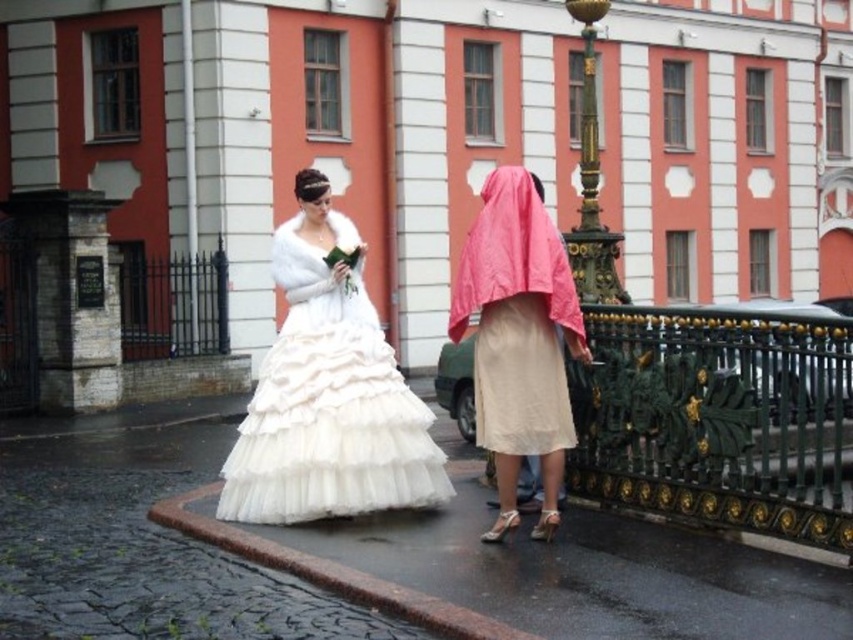
Question: Which of the following is the closest to the observer?

Choices:
 (A) gold polished metal lamp post at upper center
 (B) white tulle dress at center

Answer: (B)

Question: Does white tulle dress at center come behind pink fabric robe at center?

Choices:
 (A) no
 (B) yes

Answer: (B)

Question: Is white tulle dress at center below pink fabric robe at center?

Choices:
 (A) no
 (B) yes

Answer: (B)

Question: Considering the relative positions of pink fabric robe at center and gold polished metal lamp post at upper center in the image provided, where is pink fabric robe at center located with respect to gold polished metal lamp post at upper center?

Choices:
 (A) below
 (B) above

Answer: (A)

Question: Which of the following is the farthest from the observer?

Choices:
 (A) pink fabric robe at center
 (B) green wrought iron fence at lower right
 (C) white tulle dress at center

Answer: (C)

Question: Which of these objects is positioned farthest from the gold polished metal lamp post at upper center?

Choices:
 (A) green wrought iron fence at lower right
 (B) pink fabric robe at center

Answer: (B)